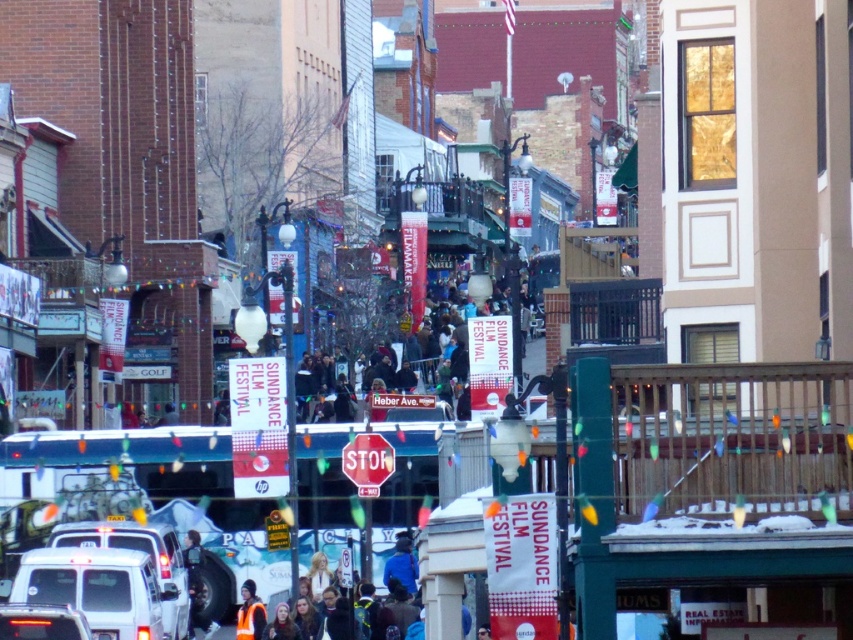
Between white matte van at lower left and matte white van at lower left, which one appears on the left side from the viewer's perspective?

From the viewer's perspective, white matte van at lower left appears more on the left side.

Can you confirm if white matte van at lower left is positioned to the left of matte white van at lower left?

Correct, you'll find white matte van at lower left to the left of matte white van at lower left.

Is point (79, 596) in front of point (10, 616)?

No, (79, 596) is behind (10, 616).

You are a GUI agent. You are given a task and a screenshot of the screen. Output one action in this format:
    pyautogui.click(x=<x>, y=<y>)
    Task: Click on the white matte van at lower left
    Image resolution: width=853 pixels, height=640 pixels.
    Given the screenshot: What is the action you would take?
    pyautogui.click(x=96, y=588)

Can you confirm if matte white van at lower left is bigger than reflective yellow vest at lower center?

Actually, matte white van at lower left might be smaller than reflective yellow vest at lower center.

Is matte white van at lower left smaller than reflective yellow vest at lower center?

Correct, matte white van at lower left occupies less space than reflective yellow vest at lower center.

This screenshot has height=640, width=853. Identify the location of matte white van at lower left. (41, 621).

At what (x,y) coordinates should I click in order to perform the action: click on matte white van at lower left. Please return your answer as a coordinate pair (x, y). The image size is (853, 640). Looking at the image, I should click on (41, 621).

Is white matte van at lower left to the right of reflective yellow vest at lower center from the viewer's perspective?

Incorrect, white matte van at lower left is not on the right side of reflective yellow vest at lower center.

The image size is (853, 640). What do you see at coordinates (96, 588) in the screenshot? I see `white matte van at lower left` at bounding box center [96, 588].

The width and height of the screenshot is (853, 640). Identify the location of white matte van at lower left. (96, 588).